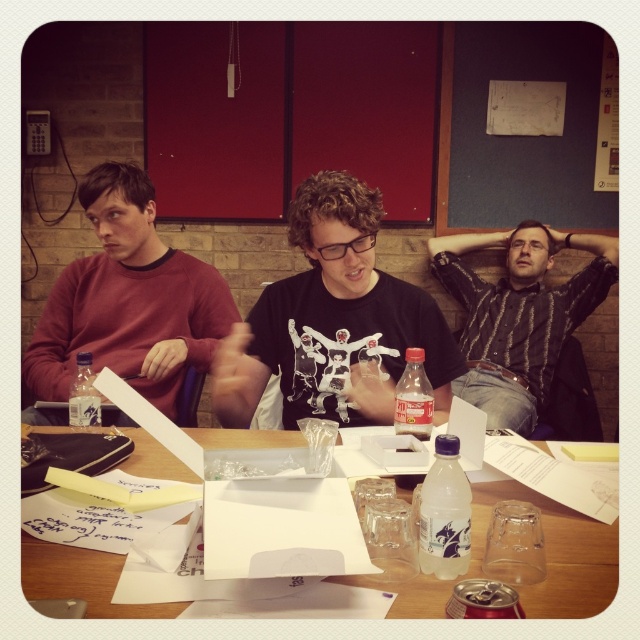
You are a photographer setting up a shot of the scene. You need to ensure that the matte red sweater at left is visible in the frame without being blocked by the translucent plastic bottle at center. Based on their positions, is this possible?

The matte red sweater at left is above the translucent plastic bottle at center, so it should be visible in the frame without obstruction from the bottle.

You are standing in the room and want to place a small plant on the wooden table at center. The point where you want to place it is at coordinates point (556,554). Is this point on the wooden table at center?

Yes, the point (556,554) is on the wooden table at center, so you can place the plant there.